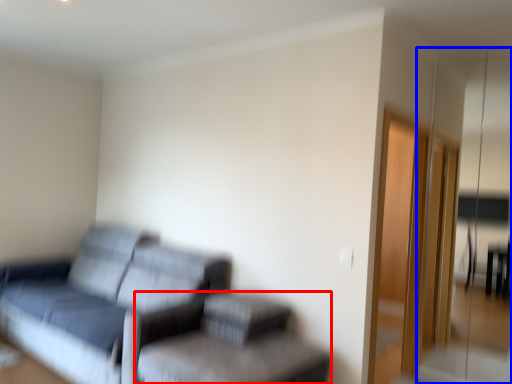
Question: Which object appears farthest to the camera in this image, swivel chair (highlighted by a red box) or glass door (highlighted by a blue box)?

Choices:
 (A) swivel chair
 (B) glass door

Answer: (B)